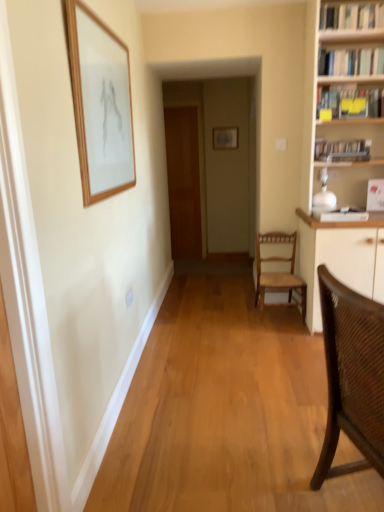
Image resolution: width=384 pixels, height=512 pixels. What do you see at coordinates (279, 271) in the screenshot? I see `wooden chair at center, the 2th chair in the front-to-back sequence` at bounding box center [279, 271].

Image resolution: width=384 pixels, height=512 pixels. Describe the element at coordinates (350, 101) in the screenshot. I see `hardcover book at upper right, the 2th book from the bottom` at that location.

Locate an element on the screen. The image size is (384, 512). white glossy bookshelf at upper right, marked as the second book in a top-to-bottom arrangement is located at coordinates (351, 62).

At what (x,y) coordinates should I click in order to perform the action: click on hardcover books at upper right, positioned as the fourth book in top-to-bottom order. Please return your answer as a coordinate pair (x, y). The height and width of the screenshot is (512, 384). Looking at the image, I should click on pyautogui.click(x=342, y=150).

Is hardcover book at upper right, which appears as the third book when viewed from the top, aimed at wooden door at center?

No, hardcover book at upper right, which appears as the third book when viewed from the top, is not turned towards wooden door at center.

Which is correct: hardcover book at upper right, the 2th book from the bottom, is inside wooden door at center, or outside of it?

hardcover book at upper right, the 2th book from the bottom, is not enclosed by wooden door at center.

Find the location of `the 1st book positioned above the wooden door at center (from the image's perspective)`. the 1st book positioned above the wooden door at center (from the image's perspective) is located at coordinates (350, 101).

Can you confirm if hardcover book at upper right, which appears as the third book when viewed from the top, is thinner than wooden door at center?

No.

Is hardcover book at upper right, the 2th book from the bottom, located outside brown woven chair at right, which ranks as the 1th chair in front-to-back order?

That's correct, hardcover book at upper right, the 2th book from the bottom, is outside of brown woven chair at right, which ranks as the 1th chair in front-to-back order.

Is hardcover book at upper right, which appears as the third book when viewed from the top, looking in the opposite direction of brown woven chair at right, the second chair viewed from the back?

No, brown woven chair at right, the second chair viewed from the back, is not at the back of hardcover book at upper right, which appears as the third book when viewed from the top.

Which point is more forward, [320,86] or [381,406]?

Positioned in front is point [381,406].

In the image, is hardcover book at upper right, the 2th book from the bottom, on the left side or the right side of brown woven chair at right, which ranks as the 1th chair in front-to-back order?

Based on their positions, hardcover book at upper right, the 2th book from the bottom, is located to the right of brown woven chair at right, which ranks as the 1th chair in front-to-back order.

Between hardcover books at upper right, acting as the 1th book starting from the bottom, and white glossy bookshelf at upper right, which appears as the first book when viewed from the top, which one is positioned in front?

Positioned in front is white glossy bookshelf at upper right, which appears as the first book when viewed from the top.

Looking at this image, which point is more forward, (341, 146) or (360, 12)?

The point (360, 12) is more forward.

Considering the sizes of objects hardcover books at upper right, acting as the 1th book starting from the bottom, and white glossy bookshelf at upper right, which ranks as the fourth book in bottom-to-top order, in the image provided, who is taller, hardcover books at upper right, acting as the 1th book starting from the bottom, or white glossy bookshelf at upper right, which ranks as the fourth book in bottom-to-top order,?

Standing taller between the two is white glossy bookshelf at upper right, which ranks as the fourth book in bottom-to-top order.

Between hardcover books at upper right, acting as the 1th book starting from the bottom, and white glossy bookshelf at upper right, which ranks as the fourth book in bottom-to-top order, which one appears on the left side from the viewer's perspective?

From the viewer's perspective, white glossy bookshelf at upper right, which ranks as the fourth book in bottom-to-top order, appears more on the left side.

Based on the photo, from the image's perspective, is brown woven chair at right, the second chair viewed from the back, positioned above or below wooden picture frame at upper left, the 1th picture frame viewed from the front?

From the image's perspective, brown woven chair at right, the second chair viewed from the back, appears below wooden picture frame at upper left, the 1th picture frame viewed from the front.

Considering the points (338, 285) and (125, 64), which point is behind, point (338, 285) or point (125, 64)?

The point (125, 64) is behind.

Which of these two, brown woven chair at right, which ranks as the 1th chair in front-to-back order, or wooden picture frame at upper left, which ranks as the first picture frame in bottom-to-top order, is thinner?

With smaller width is wooden picture frame at upper left, which ranks as the first picture frame in bottom-to-top order.

From a real-world perspective, who is located higher, brown woven chair at right, which ranks as the 1th chair in front-to-back order, or wooden picture frame at upper left, acting as the second picture frame starting from the back?

wooden picture frame at upper left, acting as the second picture frame starting from the back, from a real-world perspective.

Looking at their sizes, would you say white glossy bookshelf at upper right, marked as the second book in a top-to-bottom arrangement, is wider or thinner than hardcover books at upper right, positioned as the fourth book in top-to-bottom order?

white glossy bookshelf at upper right, marked as the second book in a top-to-bottom arrangement, is wider than hardcover books at upper right, positioned as the fourth book in top-to-bottom order.

From a real-world perspective, is white glossy bookshelf at upper right, which ranks as the 3th book in bottom-to-top order, located higher than hardcover books at upper right, acting as the 1th book starting from the bottom?

Indeed, from a real-world perspective, white glossy bookshelf at upper right, which ranks as the 3th book in bottom-to-top order, stands above hardcover books at upper right, acting as the 1th book starting from the bottom.

How many degrees apart are the facing directions of white glossy bookshelf at upper right, marked as the second book in a top-to-bottom arrangement, and hardcover books at upper right, positioned as the fourth book in top-to-bottom order?

3.7 degrees separate the facing orientations of white glossy bookshelf at upper right, marked as the second book in a top-to-bottom arrangement, and hardcover books at upper right, positioned as the fourth book in top-to-bottom order.

From the image's perspective, relative to hardcover books at upper right, positioned as the fourth book in top-to-bottom order, is white glossy bookshelf at upper right, which ranks as the 3th book in bottom-to-top order, above or below?

white glossy bookshelf at upper right, which ranks as the 3th book in bottom-to-top order, is situated higher than hardcover books at upper right, positioned as the fourth book in top-to-bottom order, in the image.

Which of these two, wooden chair at center, the 2th chair in the front-to-back sequence, or wooden picture frame at upper left, which appears as the 2th picture frame when viewed from the top, stands shorter?

With less height is wooden chair at center, the 2th chair in the front-to-back sequence.

Is wooden chair at center, the 2th chair in the front-to-back sequence, far away from wooden picture frame at upper left, the 1th picture frame viewed from the front?

Indeed, wooden chair at center, the 2th chair in the front-to-back sequence, is not near wooden picture frame at upper left, the 1th picture frame viewed from the front.

Measure the distance from wooden chair at center, the 2th chair in the front-to-back sequence, to wooden picture frame at upper left, which is the 1th picture frame from left to right.

1.63 meters.

Considering the points (271, 292) and (87, 90), which point is behind, point (271, 292) or point (87, 90)?

The point (271, 292) is farther.

Can you confirm if matte gray picture frame at center, the second picture frame in the bottom-to-top sequence, is positioned to the right of brown woven chair at right, which ranks as the 1th chair in front-to-back order?

In fact, matte gray picture frame at center, the second picture frame in the bottom-to-top sequence, is to the left of brown woven chair at right, which ranks as the 1th chair in front-to-back order.

Locate an element on the screen. chair that is the 1st one when counting rightward from the matte gray picture frame at center, which is counted as the 1th picture frame, starting from the top is located at coordinates (352, 376).

In the scene shown: Between matte gray picture frame at center, marked as the first picture frame in a back-to-front arrangement, and brown woven chair at right, the second chair viewed from the back, which one has smaller width?

matte gray picture frame at center, marked as the first picture frame in a back-to-front arrangement.

Is matte gray picture frame at center, the 1th picture frame from the right, touching brown woven chair at right, which ranks as the 1th chair in front-to-back order?

No, matte gray picture frame at center, the 1th picture frame from the right, is not in contact with brown woven chair at right, which ranks as the 1th chair in front-to-back order.

At what (x,y) coordinates should I click in order to perform the action: click on door below the hardcover book at upper right, the 2th book from the bottom (from the image's perspective). Please return your answer as a coordinate pair (x, y). The image size is (384, 512). Looking at the image, I should click on (183, 181).

Identify the location of the 2nd chair counting from the left side of the hardcover book at upper right, which appears as the third book when viewed from the top. (352, 376).

When comparing their distances from wooden door at center, does hardcover books at upper right, acting as the 1th book starting from the bottom, or white glossy bookshelf at upper right, which appears as the first book when viewed from the top, seem further?

The object further to wooden door at center is white glossy bookshelf at upper right, which appears as the first book when viewed from the top.

From the image, which object appears to be farther from white glossy bookshelf at upper right, which ranks as the 3th book in bottom-to-top order, matte gray picture frame at center, marked as the first picture frame in a back-to-front arrangement, or wooden chair at center, the first chair when ordered from back to front?

Among the two, matte gray picture frame at center, marked as the first picture frame in a back-to-front arrangement, is located further to white glossy bookshelf at upper right, which ranks as the 3th book in bottom-to-top order.

Looking at the image, which one is located closer to hardcover books at upper right, positioned as the fourth book in top-to-bottom order, hardcover book at upper right, the 2th book from the bottom, or white glossy bookshelf at upper right, which ranks as the fourth book in bottom-to-top order?

hardcover book at upper right, the 2th book from the bottom, lies closer to hardcover books at upper right, positioned as the fourth book in top-to-bottom order, than the other object.

Looking at the image, which one is located further to matte gray picture frame at center, which is counted as the 1th picture frame, starting from the top, brown woven chair at right, which ranks as the 1th chair in front-to-back order, or hardcover books at upper right, positioned as the fourth book in top-to-bottom order?

Based on the image, brown woven chair at right, which ranks as the 1th chair in front-to-back order, appears to be further to matte gray picture frame at center, which is counted as the 1th picture frame, starting from the top.

Considering their positions, is wooden door at center positioned closer to hardcover books at upper right, positioned as the fourth book in top-to-bottom order, than hardcover book at upper right, the 2th book from the bottom?

Among the two, hardcover book at upper right, the 2th book from the bottom, is located nearer to hardcover books at upper right, positioned as the fourth book in top-to-bottom order.

Which object lies nearer to the anchor point matte gray picture frame at center, the second picture frame in the bottom-to-top sequence, wooden chair at center, the 2th chair in the front-to-back sequence, or white glossy bookshelf at upper right, which ranks as the 3th book in bottom-to-top order?

The object closer to matte gray picture frame at center, the second picture frame in the bottom-to-top sequence, is wooden chair at center, the 2th chair in the front-to-back sequence.

Considering their positions, is hardcover book at upper right, the 2th book from the bottom, positioned closer to wooden door at center than white glossy bookshelf at upper right, marked as the second book in a top-to-bottom arrangement?

hardcover book at upper right, the 2th book from the bottom, is closer to wooden door at center.

Which object lies nearer to the anchor point hardcover book at upper right, which appears as the third book when viewed from the top, wooden door at center or hardcover books at upper right, acting as the 1th book starting from the bottom?

Based on the image, hardcover books at upper right, acting as the 1th book starting from the bottom, appears to be nearer to hardcover book at upper right, which appears as the third book when viewed from the top.

Identify the location of picture frame between white glossy bookshelf at upper right, which ranks as the 3th book in bottom-to-top order, and brown woven chair at right, the second chair viewed from the back, vertically. This screenshot has width=384, height=512. (100, 104).

Identify the location of book that lies between hardcover book at upper right, the 2th book from the bottom, and wooden chair at center, the first chair when ordered from back to front, from top to bottom. (342, 150).

Identify the location of chair located between hardcover book at upper right, which appears as the third book when viewed from the top, and wooden door at center in the depth direction. This screenshot has width=384, height=512. (279, 271).

The width and height of the screenshot is (384, 512). Find the location of `picture frame between brown woven chair at right, which ranks as the 1th chair in front-to-back order, and hardcover book at upper right, the 2th book from the bottom, from front to back`. picture frame between brown woven chair at right, which ranks as the 1th chair in front-to-back order, and hardcover book at upper right, the 2th book from the bottom, from front to back is located at coordinates (100, 104).